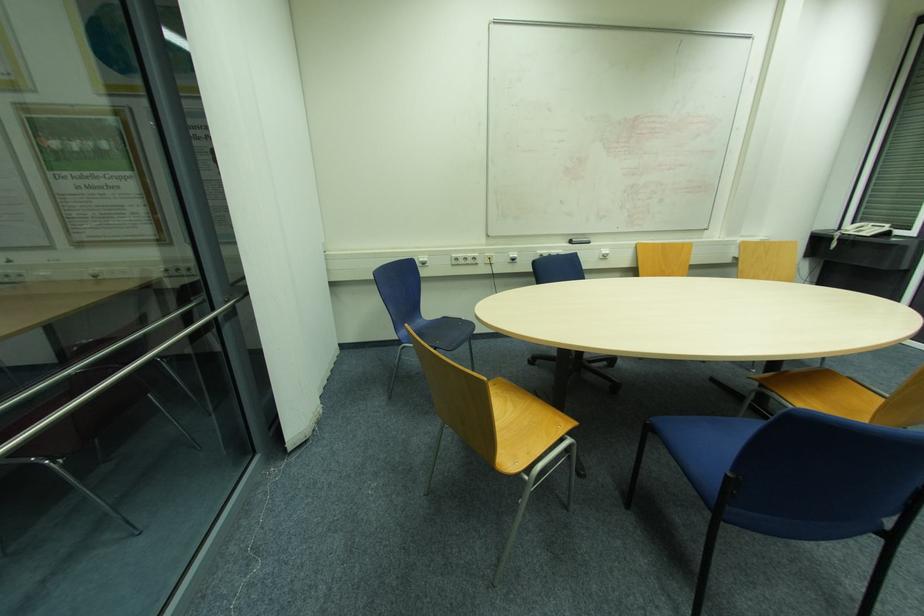
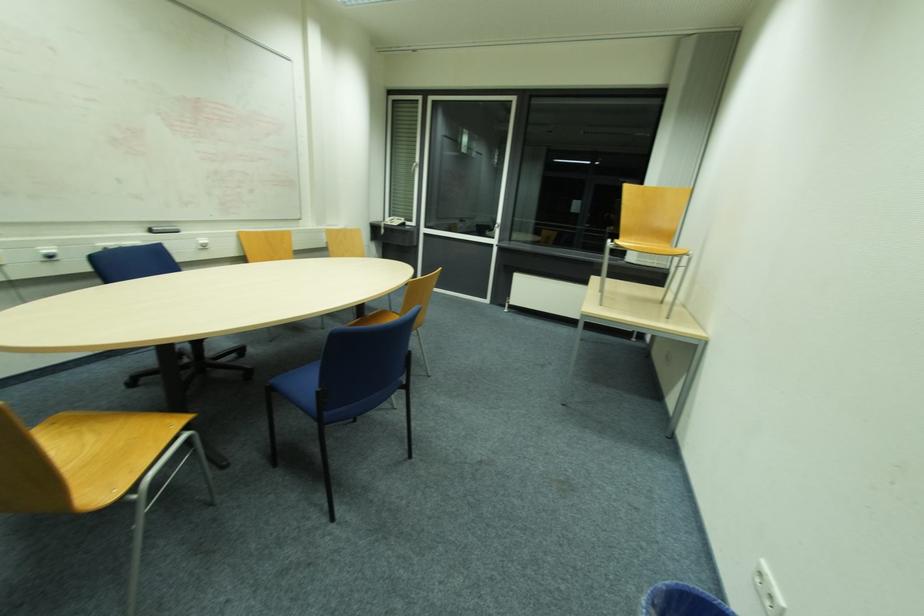
In the second image, find the point that corresponds to (869,233) in the first image.

(397, 225)